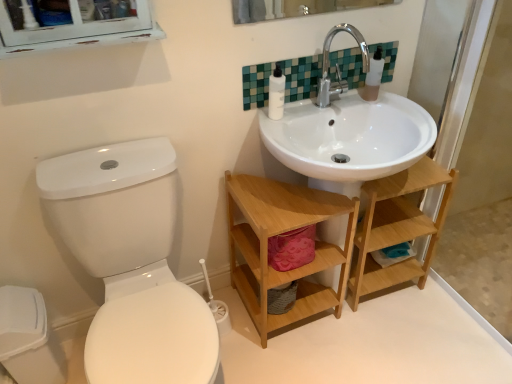
Identify the location of vacant space in front of transparent glass screen door at right. (460, 346).